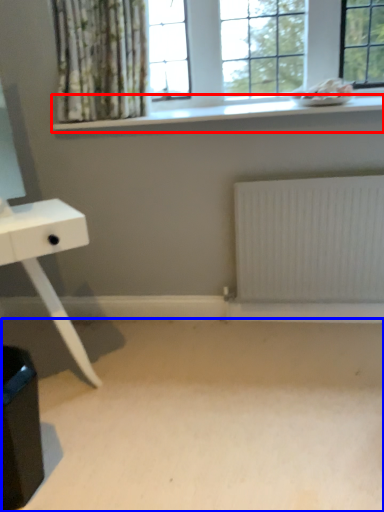
Question: Which of the following is the farthest to the observer, window sill (highlighted by a red box) or plain (highlighted by a blue box)?

Choices:
 (A) window sill
 (B) plain

Answer: (A)